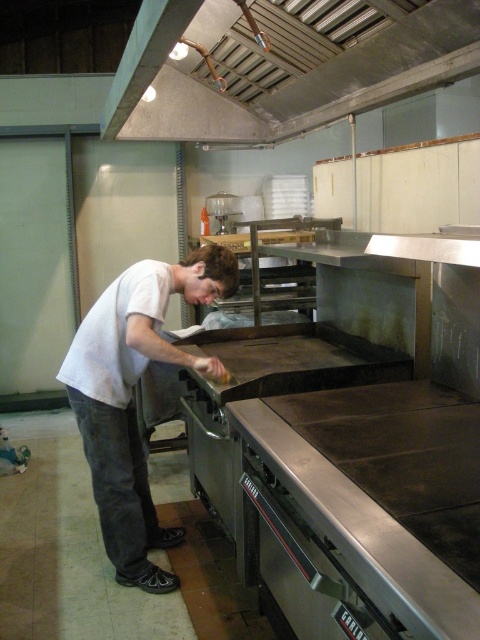
Question: Is metallic at upper center behind white matte shirt at center?

Choices:
 (A) no
 (B) yes

Answer: (A)

Question: Does metallic at upper center appear over white matte shirt at center?

Choices:
 (A) yes
 (B) no

Answer: (A)

Question: Among these objects, which one is nearest to the camera?

Choices:
 (A) metallic at upper center
 (B) white matte shirt at center

Answer: (A)

Question: Does metallic at upper center come behind white matte shirt at center?

Choices:
 (A) no
 (B) yes

Answer: (A)

Question: Which point appears farthest from the camera in this image?

Choices:
 (A) (90, 342)
 (B) (317, 74)

Answer: (B)